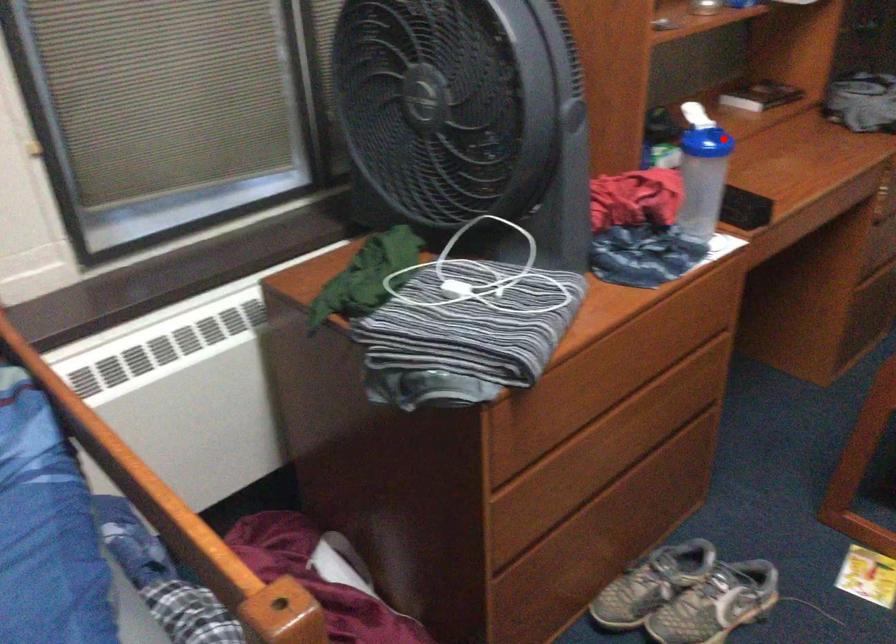
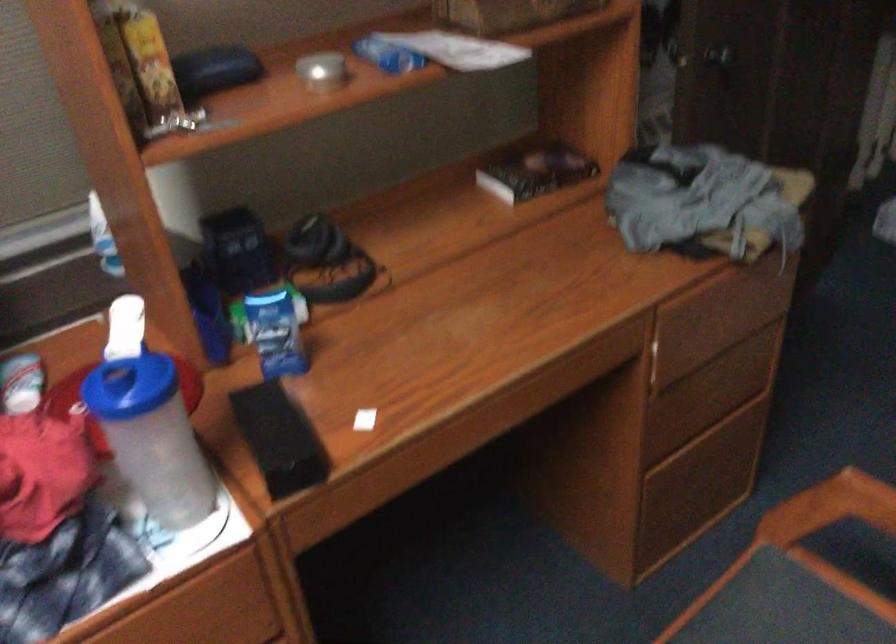
Question: I am providing you with two images of the same scene from different viewpoints. Image1 has a red point marked. In image2, the corresponding 3D location appears at what relative position? Reply with the corresponding letter.

Choices:
 (A) Closer
 (B) Farther

Answer: (A)